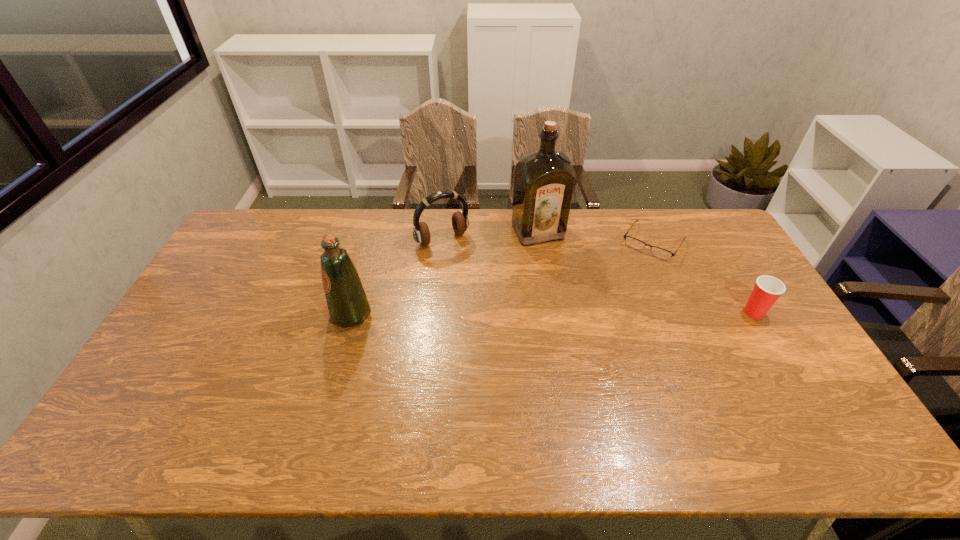
Find the location of `vacant space that's between the third tallest object and the leftmost object`. vacant space that's between the third tallest object and the leftmost object is located at coordinates (396, 277).

Locate an element on the screen. empty location between the leftmost object and the fourth tallest object is located at coordinates tap(552, 314).

Locate an element on the screen. The width and height of the screenshot is (960, 540). vacant area that lies between the fourth object from left to right and the third object from left to right is located at coordinates (596, 237).

Identify which object is the second closest to the third shortest object. Please provide its 2D coordinates. Your answer should be formatted as a tuple, i.e. [(x, y)], where the tuple contains the x and y coordinates of a point satisfying the conditions above.

[(348, 306)]

At what (x,y) coordinates should I click in order to perform the action: click on the fourth closest object to the Dixie cup. Please return your answer as a coordinate pair (x, y). Looking at the image, I should click on (348, 306).

The height and width of the screenshot is (540, 960). Find the location of `vacant position in the image that satisfies the following two spatial constraints: 1. on the front side of the fourth object from right to left; 2. on the right side of the fourth tallest object`. vacant position in the image that satisfies the following two spatial constraints: 1. on the front side of the fourth object from right to left; 2. on the right side of the fourth tallest object is located at coordinates [435, 312].